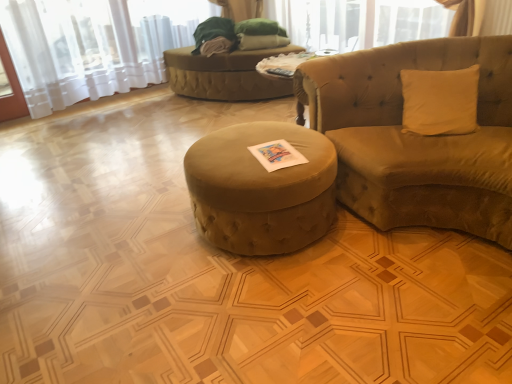
Where is `velvet green bean bag at center`? This screenshot has height=384, width=512. velvet green bean bag at center is located at coordinates (224, 74).

Find the location of a particular element. white sheer curtain at upper left is located at coordinates (94, 45).

At what (x,y) coordinates should I click in order to perform the action: click on velvet beige studio couch at right. Please return your answer as a coordinate pair (x, y). The image size is (512, 384). Looking at the image, I should click on 417,136.

From the image's perspective, which one is positioned lower, white sheer curtain at upper left or velvet green ottoman at center?

velvet green ottoman at center appears lower in the image.

Is white sheer curtain at upper left to the left of velvet green ottoman at center from the viewer's perspective?

Yes.

Are white sheer curtain at upper left and velvet green ottoman at center located far from each other?

Yes, white sheer curtain at upper left is far from velvet green ottoman at center.

Where is `table located in front of the white sheer curtain at upper left`? The width and height of the screenshot is (512, 384). table located in front of the white sheer curtain at upper left is located at coordinates (261, 189).

From the picture: Considering the sizes of objects velvet green bean bag at center and white sheer curtain at upper left in the image provided, who is thinner, velvet green bean bag at center or white sheer curtain at upper left?

white sheer curtain at upper left is thinner.

Looking at this image, is velvet green bean bag at center inside the boundaries of white sheer curtain at upper left, or outside?

velvet green bean bag at center is spatially situated outside white sheer curtain at upper left.

From a real-world perspective, which object stands above the other?

white sheer curtain at upper left is physically above.

From the image's perspective, which object appears higher, velvet green bean bag at center or white sheer curtain at upper left?

Answer: white sheer curtain at upper left.

From the image's perspective, is white sheer curtain at upper left over velvet green bean bag at center?

Yes.

Is white sheer curtain at upper left inside or outside of velvet green bean bag at center?

white sheer curtain at upper left exists outside the volume of velvet green bean bag at center.

Considering the relative sizes of white sheer curtain at upper left and velvet green bean bag at center in the image provided, is white sheer curtain at upper left thinner than velvet green bean bag at center?

Yes, white sheer curtain at upper left is thinner than velvet green bean bag at center.

Can you confirm if white sheer curtain at upper left is taller than velvet green bean bag at center?

Yes.

From the image's perspective, which one is positioned lower, velvet green bean bag at center or velvet green ottoman at center?

velvet green ottoman at center is shown below in the image.

Looking at this image, can you confirm if velvet green bean bag at center is smaller than velvet green ottoman at center?

No, velvet green bean bag at center is not smaller than velvet green ottoman at center.

Is velvet green bean bag at center in front of or behind velvet green ottoman at center in the image?

velvet green bean bag at center is behind velvet green ottoman at center.

Is velvet green ottoman at center at the back of velvet beige studio couch at right?

No, velvet beige studio couch at right is not facing away from velvet green ottoman at center.

Considering the relative positions of velvet beige studio couch at right and velvet green ottoman at center in the image provided, is velvet beige studio couch at right to the left of velvet green ottoman at center from the viewer's perspective?

No, velvet beige studio couch at right is not to the left of velvet green ottoman at center.

Is velvet beige studio couch at right wider than velvet green ottoman at center?

Correct, the width of velvet beige studio couch at right exceeds that of velvet green ottoman at center.

From the image's perspective, is velvet beige studio couch at right above or below velvet green ottoman at center?

Based on their image positions, velvet beige studio couch at right is located above velvet green ottoman at center.

Could you tell me if velvet beige studio couch at right is facing velvet green bean bag at center?

No, velvet beige studio couch at right is not facing towards velvet green bean bag at center.

From a real-world perspective, is velvet beige studio couch at right under velvet green bean bag at center?

No, from a real-world perspective, velvet beige studio couch at right is not beneath velvet green bean bag at center.

Looking at this image, considering the relative sizes of velvet beige studio couch at right and velvet green bean bag at center in the image provided, is velvet beige studio couch at right smaller than velvet green bean bag at center?

Incorrect, velvet beige studio couch at right is not smaller in size than velvet green bean bag at center.

Do you think velvet green bean bag at center is within velvet beige studio couch at right, or outside of it?

velvet green bean bag at center cannot be found inside velvet beige studio couch at right.

Based on their sizes in the image, would you say velvet green bean bag at center is bigger or smaller than velvet beige studio couch at right?

Considering their sizes, velvet green bean bag at center takes up less space than velvet beige studio couch at right.

You are a GUI agent. You are given a task and a screenshot of the screen. Output one action in this format:
    pyautogui.click(x=<x>, y=<y>)
    Task: Click on the bean bag chair on the left of velvet beige studio couch at right
    The image size is (512, 384).
    Given the screenshot: What is the action you would take?
    pyautogui.click(x=224, y=74)

The height and width of the screenshot is (384, 512). In order to click on table below the white sheer curtain at upper left (from the image's perspective) in this screenshot , I will do `click(261, 189)`.

Locate an element on the screen. Image resolution: width=512 pixels, height=384 pixels. curtain lying in front of the velvet green bean bag at center is located at coordinates (94, 45).

Looking at this image, based on their spatial positions, is velvet green bean bag at center or velvet green ottoman at center further from white sheer curtain at upper left?

Among the two, velvet green ottoman at center is located further to white sheer curtain at upper left.

Which object lies further to the anchor point velvet green bean bag at center, velvet beige studio couch at right or velvet green ottoman at center?

The object further to velvet green bean bag at center is velvet green ottoman at center.

When comparing their distances from velvet green ottoman at center, does white sheer curtain at upper left or velvet beige studio couch at right seem further?

Based on the image, white sheer curtain at upper left appears to be further to velvet green ottoman at center.

Which object lies nearer to the anchor point velvet green bean bag at center, velvet beige studio couch at right or white sheer curtain at upper left?

white sheer curtain at upper left lies closer to velvet green bean bag at center than the other object.

Looking at the image, which one is located further to velvet beige studio couch at right, velvet green bean bag at center or velvet green ottoman at center?

Based on the image, velvet green bean bag at center appears to be further to velvet beige studio couch at right.

Estimate the real-world distances between objects in this image. Which object is closer to white sheer curtain at upper left, velvet green bean bag at center or velvet beige studio couch at right?

The object closer to white sheer curtain at upper left is velvet green bean bag at center.

Considering their positions, is velvet beige studio couch at right positioned further to white sheer curtain at upper left than velvet green ottoman at center?

velvet beige studio couch at right is further to white sheer curtain at upper left.

When comparing their distances from velvet green ottoman at center, does velvet beige studio couch at right or white sheer curtain at upper left seem closer?

Among the two, velvet beige studio couch at right is located nearer to velvet green ottoman at center.

At what (x,y) coordinates should I click in order to perform the action: click on curtain between velvet green ottoman at center and velvet green bean bag at center in the front-back direction. Please return your answer as a coordinate pair (x, y). The width and height of the screenshot is (512, 384). Looking at the image, I should click on (94, 45).

Where is `curtain between velvet beige studio couch at right and velvet green bean bag at center from front to back`? The height and width of the screenshot is (384, 512). curtain between velvet beige studio couch at right and velvet green bean bag at center from front to back is located at coordinates (94, 45).

The image size is (512, 384). Identify the location of table located between velvet beige studio couch at right and velvet green bean bag at center in the depth direction. (261, 189).

This screenshot has width=512, height=384. In order to click on table between white sheer curtain at upper left and velvet beige studio couch at right from left to right in this screenshot , I will do `click(261, 189)`.